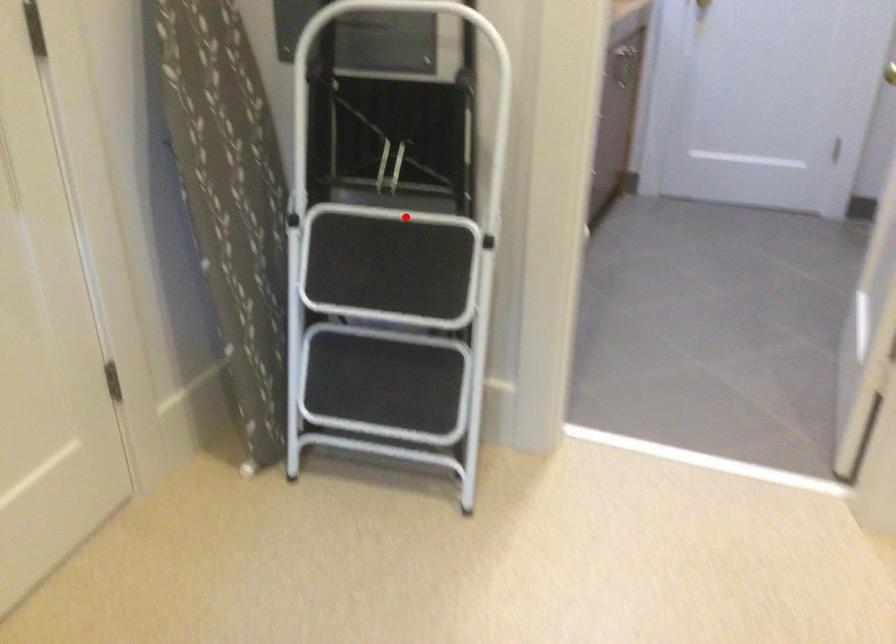
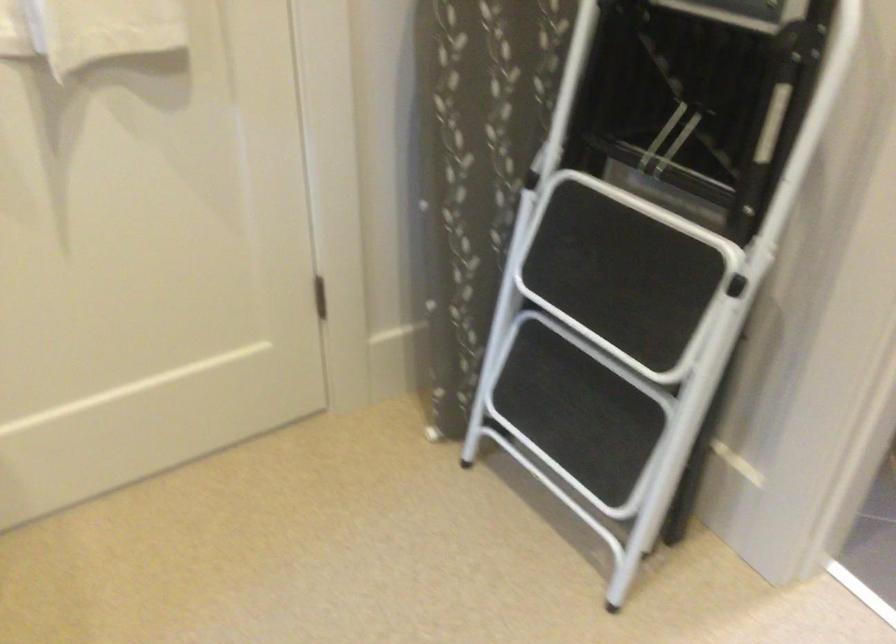
The point at the highlighted location is marked in the first image. Where is the corresponding point in the second image?

(658, 216)